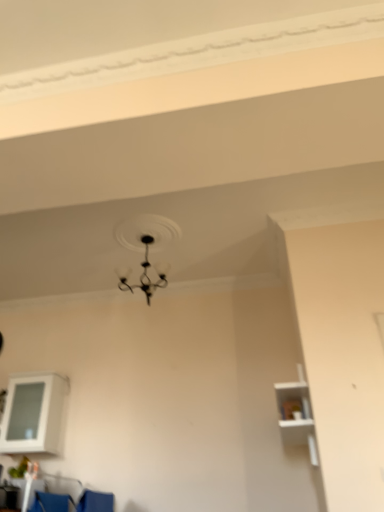
This screenshot has height=512, width=384. Find the location of `black matte chandelier at upper center`. black matte chandelier at upper center is located at coordinates (144, 275).

Locate an element on the screen. Image resolution: width=384 pixels, height=512 pixels. white matte shelf at right, the 2th shelf in the back-to-front sequence is located at coordinates (296, 414).

Measure the distance between point (55,452) and camera.

Point (55,452) is 4.29 meters from camera.

Locate an element on the screen. blue fabric armchair at lower left is located at coordinates (50, 502).

Between blue fabric armchair at lower left and black matte chandelier at upper center, which one appears on the right side from the viewer's perspective?

black matte chandelier at upper center.

Can you confirm if blue fabric armchair at lower left is shorter than black matte chandelier at upper center?

Yes, blue fabric armchair at lower left is shorter than black matte chandelier at upper center.

From a real-world perspective, between blue fabric armchair at lower left and black matte chandelier at upper center, who is vertically higher?

From a 3D spatial view, black matte chandelier at upper center is above.

Between blue fabric armchair at lower left and black matte chandelier at upper center, which one has larger size?

Bigger between the two is black matte chandelier at upper center.

From the image's perspective, would you say black matte chandelier at upper center is shown under white glossy cabinet at lower left, marked as the 2th shelf in a front-to-back arrangement?

Actually, black matte chandelier at upper center appears above white glossy cabinet at lower left, marked as the 2th shelf in a front-to-back arrangement, in the image.

Is the surface of black matte chandelier at upper center in direct contact with white glossy cabinet at lower left, marked as the 1th shelf in a left-to-right arrangement?

black matte chandelier at upper center and white glossy cabinet at lower left, marked as the 1th shelf in a left-to-right arrangement, are clearly separated.

From a real-world perspective, which is physically above, black matte chandelier at upper center or white glossy cabinet at lower left, marked as the 2th shelf in a front-to-back arrangement?

black matte chandelier at upper center, from a real-world perspective.

From the image's perspective, is white matte shelf at right, which is the first shelf in right-to-left order, on blue fabric armchair at lower left?

Yes, from the image's perspective, white matte shelf at right, which is the first shelf in right-to-left order, is above blue fabric armchair at lower left.

You are a GUI agent. You are given a task and a screenshot of the screen. Output one action in this format:
    pyautogui.click(x=<x>, y=<y>)
    Task: Click on the shelf lying in front of the blue fabric armchair at lower left
    This screenshot has height=512, width=384.
    Given the screenshot: What is the action you would take?
    pyautogui.click(x=296, y=414)

Are white matte shelf at right, the second shelf when ordered from left to right, and blue fabric armchair at lower left far apart?

Indeed, white matte shelf at right, the second shelf when ordered from left to right, is not near blue fabric armchair at lower left.

Is white matte shelf at right, the 2th shelf in the back-to-front sequence, turned away from blue fabric armchair at lower left?

That's not correct — white matte shelf at right, the 2th shelf in the back-to-front sequence, is not looking away from blue fabric armchair at lower left.

How different are the orientations of white matte shelf at right, the 2th shelf in the back-to-front sequence, and white glossy cabinet at lower left, marked as the 2th shelf in a front-to-back arrangement, in degrees?

They differ by 89.5 degrees in their facing directions.

Which point is more forward, (279, 409) or (29, 453)?

Positioned in front is point (279, 409).

Is the position of white matte shelf at right, arranged as the first shelf when viewed from the front, less distant than that of white glossy cabinet at lower left, the 2th shelf viewed from the right?

Yes, white matte shelf at right, arranged as the first shelf when viewed from the front, is closer to the camera.

Is white glossy cabinet at lower left, which is the first shelf from back to front, surrounded by white matte shelf at right, the 2th shelf in the back-to-front sequence?

Actually, white glossy cabinet at lower left, which is the first shelf from back to front, is outside white matte shelf at right, the 2th shelf in the back-to-front sequence.

Does black matte chandelier at upper center have a lesser width compared to blue fabric armchair at lower left?

No.

Is point (148, 293) positioned in front of point (68, 495)?

No, (148, 293) is behind (68, 495).

From the picture: From a real-world perspective, who is located higher, black matte chandelier at upper center or blue fabric armchair at lower left?

black matte chandelier at upper center, from a real-world perspective.

Which is in front, black matte chandelier at upper center or blue fabric armchair at lower left?

blue fabric armchair at lower left is closer to the camera.

Do you think white glossy cabinet at lower left, the 2th shelf viewed from the right, is within black matte chandelier at upper center, or outside of it?

white glossy cabinet at lower left, the 2th shelf viewed from the right, exists outside the volume of black matte chandelier at upper center.

Is white glossy cabinet at lower left, which is the first shelf from back to front, to the left or to the right of black matte chandelier at upper center in the image?

In the image, white glossy cabinet at lower left, which is the first shelf from back to front, appears on the left side of black matte chandelier at upper center.

Who is more distant, white glossy cabinet at lower left, marked as the 2th shelf in a front-to-back arrangement, or black matte chandelier at upper center?

white glossy cabinet at lower left, marked as the 2th shelf in a front-to-back arrangement.

How much distance is there between blue fabric armchair at lower left and white matte shelf at right, which is the first shelf in right-to-left order?

A distance of 7.06 feet exists between blue fabric armchair at lower left and white matte shelf at right, which is the first shelf in right-to-left order.

Consider the image. From a real-world perspective, is blue fabric armchair at lower left on top of white matte shelf at right, arranged as the first shelf when viewed from the front?

No, from a real-world perspective, blue fabric armchair at lower left is not above white matte shelf at right, arranged as the first shelf when viewed from the front.

In terms of width, does blue fabric armchair at lower left look wider or thinner when compared to white matte shelf at right, arranged as the first shelf when viewed from the front?

In the image, blue fabric armchair at lower left appears to be more narrow than white matte shelf at right, arranged as the first shelf when viewed from the front.

From the image's perspective, who appears lower, blue fabric armchair at lower left or white matte shelf at right, which is the first shelf in right-to-left order?

From the image's view, blue fabric armchair at lower left is below.

At what (x,y) coordinates should I click in order to perform the action: click on lamp that appears behind the blue fabric armchair at lower left. Please return your answer as a coordinate pair (x, y). The height and width of the screenshot is (512, 384). Looking at the image, I should click on (144, 275).

Find the location of a particular element. Image resolution: width=384 pixels, height=512 pixels. lamp above the white glossy cabinet at lower left, marked as the 1th shelf in a left-to-right arrangement (from the image's perspective) is located at coordinates (144, 275).

When comparing their distances from black matte chandelier at upper center, does white matte shelf at right, which is the first shelf in right-to-left order, or white glossy cabinet at lower left, marked as the 2th shelf in a front-to-back arrangement, seem closer?

white glossy cabinet at lower left, marked as the 2th shelf in a front-to-back arrangement, is positioned closer to the anchor black matte chandelier at upper center.

Considering their positions, is white glossy cabinet at lower left, marked as the 1th shelf in a left-to-right arrangement, positioned further to blue fabric armchair at lower left than white matte shelf at right, which is the first shelf in right-to-left order?

white matte shelf at right, which is the first shelf in right-to-left order, lies further to blue fabric armchair at lower left than the other object.

Based on the photo, from the image, which object appears to be farther from white matte shelf at right, which is the first shelf in right-to-left order, blue fabric armchair at lower left or black matte chandelier at upper center?

Among the two, blue fabric armchair at lower left is located further to white matte shelf at right, which is the first shelf in right-to-left order.

Which object lies nearer to the anchor point black matte chandelier at upper center, white matte shelf at right, which is the first shelf in right-to-left order, or blue fabric armchair at lower left?

The object closer to black matte chandelier at upper center is white matte shelf at right, which is the first shelf in right-to-left order.

Based on their spatial positions, is white glossy cabinet at lower left, marked as the 1th shelf in a left-to-right arrangement, or black matte chandelier at upper center further from white matte shelf at right, which is the first shelf in right-to-left order?

white glossy cabinet at lower left, marked as the 1th shelf in a left-to-right arrangement.

Considering their positions, is black matte chandelier at upper center positioned closer to white matte shelf at right, the 2th shelf in the back-to-front sequence, than blue fabric armchair at lower left?

The object closer to white matte shelf at right, the 2th shelf in the back-to-front sequence, is black matte chandelier at upper center.

Which object lies nearer to the anchor point blue fabric armchair at lower left, white matte shelf at right, arranged as the first shelf when viewed from the front, or white glossy cabinet at lower left, the 2th shelf viewed from the right?

Among the two, white glossy cabinet at lower left, the 2th shelf viewed from the right, is located nearer to blue fabric armchair at lower left.

Looking at the image, which one is located closer to blue fabric armchair at lower left, black matte chandelier at upper center or white matte shelf at right, which is the first shelf in right-to-left order?

Based on the image, white matte shelf at right, which is the first shelf in right-to-left order, appears to be nearer to blue fabric armchair at lower left.

Locate an element on the screen. This screenshot has width=384, height=512. armchair between white glossy cabinet at lower left, which is the first shelf from back to front, and white matte shelf at right, the second shelf when ordered from left to right is located at coordinates (50, 502).

The width and height of the screenshot is (384, 512). I want to click on lamp located between blue fabric armchair at lower left and white matte shelf at right, the second shelf when ordered from left to right, in the left-right direction, so click(x=144, y=275).

Where is `lamp located between white glossy cabinet at lower left, marked as the 1th shelf in a left-to-right arrangement, and white matte shelf at right, which is the first shelf in right-to-left order, in the left-right direction`? Image resolution: width=384 pixels, height=512 pixels. lamp located between white glossy cabinet at lower left, marked as the 1th shelf in a left-to-right arrangement, and white matte shelf at right, which is the first shelf in right-to-left order, in the left-right direction is located at coordinates (144, 275).